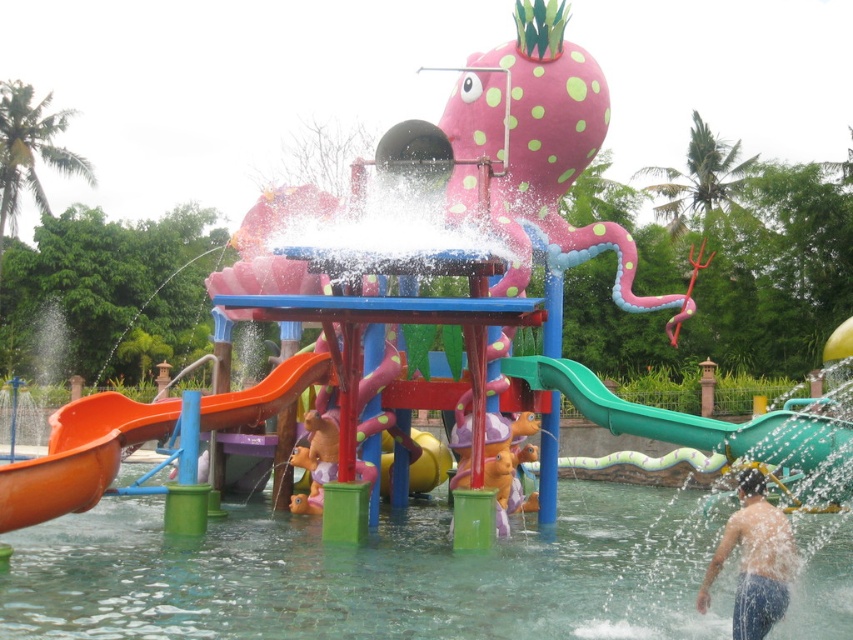
Question: Estimate the real-world distances between objects in this image. Which object is farther from the green rubber slide at right?

Choices:
 (A) smooth skin person at lower right
 (B) orange matte slide at lower left
 (C) brown plush toy at center

Answer: (B)

Question: Is orange matte slide at lower left thinner than pink rubber duck at center?

Choices:
 (A) yes
 (B) no

Answer: (B)

Question: Considering the relative positions of green rubber slide at right and smooth skin person at lower right in the image provided, where is green rubber slide at right located with respect to smooth skin person at lower right?

Choices:
 (A) right
 (B) left

Answer: (A)

Question: Which point is farther from the camera taking this photo?

Choices:
 (A) (122, 506)
 (B) (532, 419)

Answer: (A)

Question: Is green rubber slide at right closer to the viewer compared to brown plush toy at center?

Choices:
 (A) yes
 (B) no

Answer: (A)

Question: Which object is positioned closest to the orange matte slide at lower left?

Choices:
 (A) green rubber slide at right
 (B) clear water at center

Answer: (B)